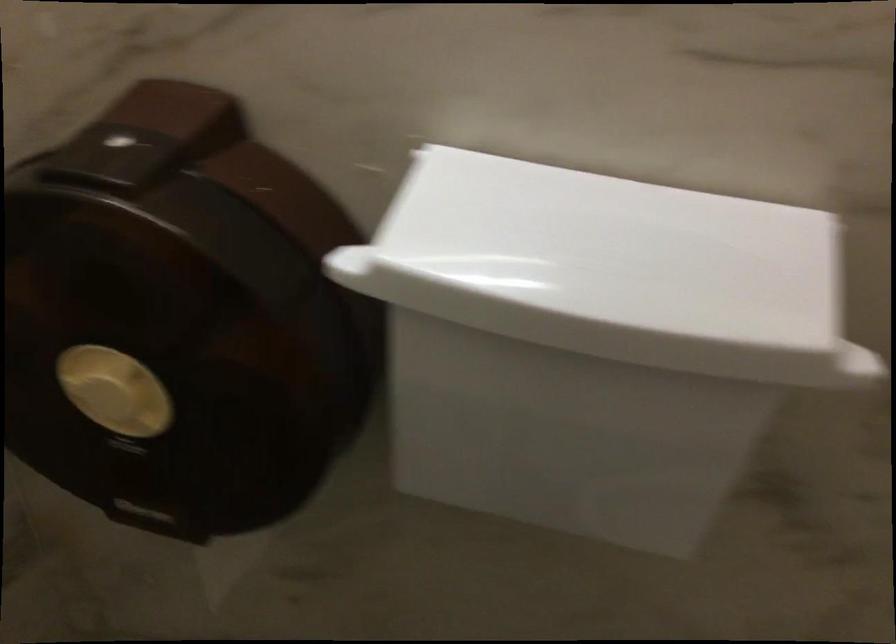
At what (x,y) coordinates should I click in order to perform the action: click on white dispenser lid. Please return your answer as a coordinate pair (x, y). The image size is (896, 644). Looking at the image, I should click on (618, 248).